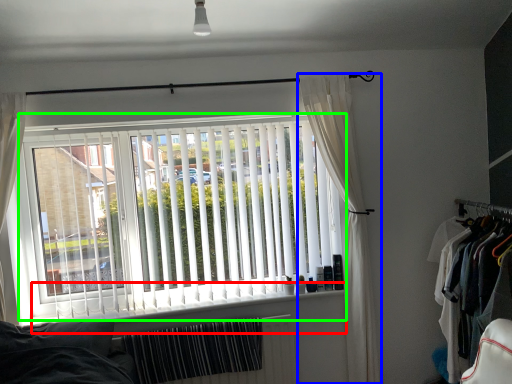
Question: Which object is positioned farthest from window sill (highlighted by a red box)? Select from curtain (highlighted by a blue box) and window blind (highlighted by a green box).

Choices:
 (A) curtain
 (B) window blind

Answer: (A)